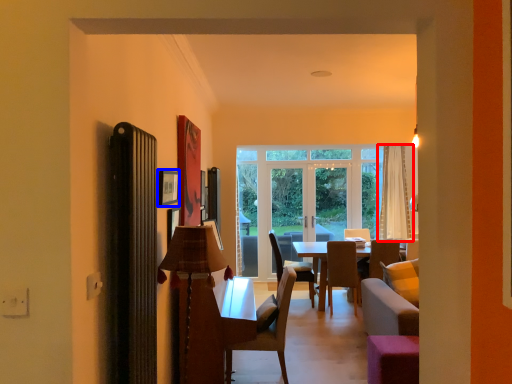
Question: Which of the following is the closest to the observer, curtain (highlighted by a red box) or picture frame (highlighted by a blue box)?

Choices:
 (A) curtain
 (B) picture frame

Answer: (B)